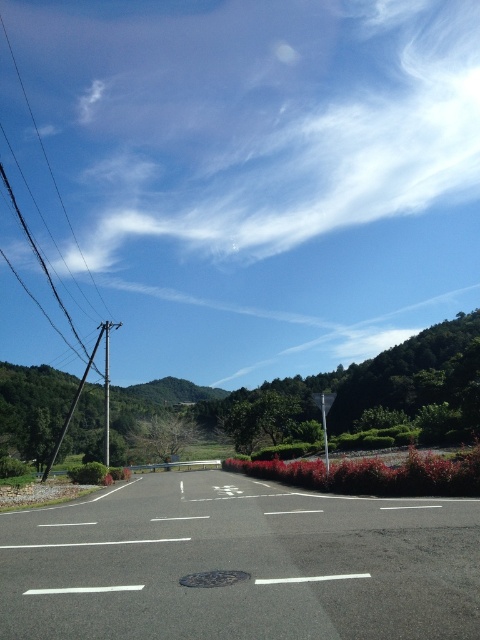
Can you confirm if metallic wire at left is shorter than metallic pole at left?

No, metallic wire at left is not shorter than metallic pole at left.

Does metallic wire at left appear on the right side of metallic pole at left?

No, metallic wire at left is not to the right of metallic pole at left.

What do you see at coordinates (48, 161) in the screenshot? Image resolution: width=480 pixels, height=640 pixels. I see `metallic wire at left` at bounding box center [48, 161].

Image resolution: width=480 pixels, height=640 pixels. What are the coordinates of `metallic wire at left` in the screenshot? It's located at (48, 161).

Is metallic wire at left bigger than smooth metallic pole at left?

Yes.

Which is above, metallic wire at left or smooth metallic pole at left?

metallic wire at left

Is point (47, 166) farther from camera compared to point (96, 346)?

Yes, point (47, 166) is behind point (96, 346).

Where is `metallic wire at left`? Image resolution: width=480 pixels, height=640 pixels. metallic wire at left is located at coordinates (48, 161).

Does smooth metallic pole at left appear on the right side of metallic pole at left?

No, smooth metallic pole at left is not to the right of metallic pole at left.

Does smooth metallic pole at left come behind metallic pole at left?

No.

The width and height of the screenshot is (480, 640). I want to click on smooth metallic pole at left, so click(x=72, y=406).